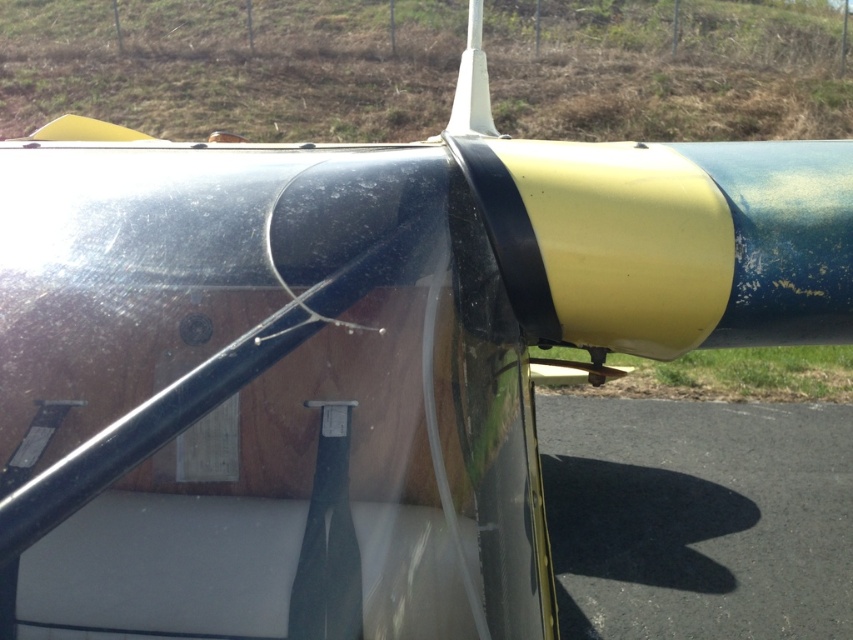
Between dry grass at upper center and black asphalt at lower right, which one has more height?

With more height is dry grass at upper center.

Between dry grass at upper center and black asphalt at lower right, which one has less height?

Standing shorter between the two is black asphalt at lower right.

The image size is (853, 640). Describe the element at coordinates (233, 65) in the screenshot. I see `dry grass at upper center` at that location.

Identify the location of dry grass at upper center. The height and width of the screenshot is (640, 853). (233, 65).